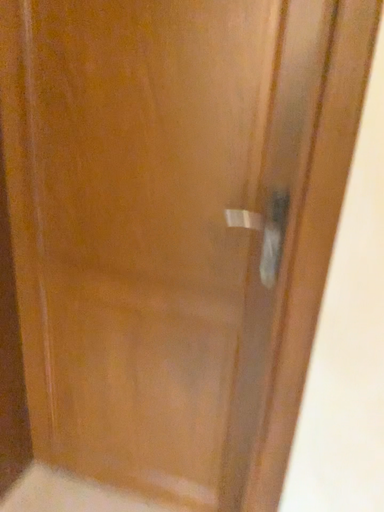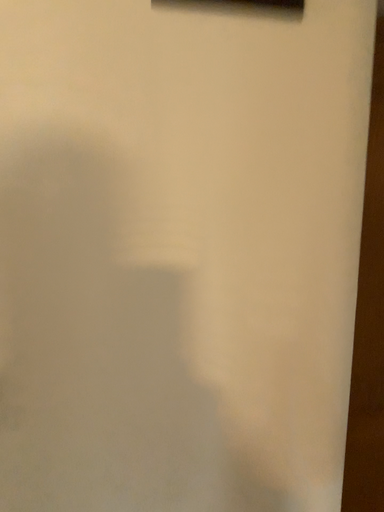
Question: How did the camera likely rotate when shooting the video?

Choices:
 (A) rotated right
 (B) rotated left

Answer: (A)